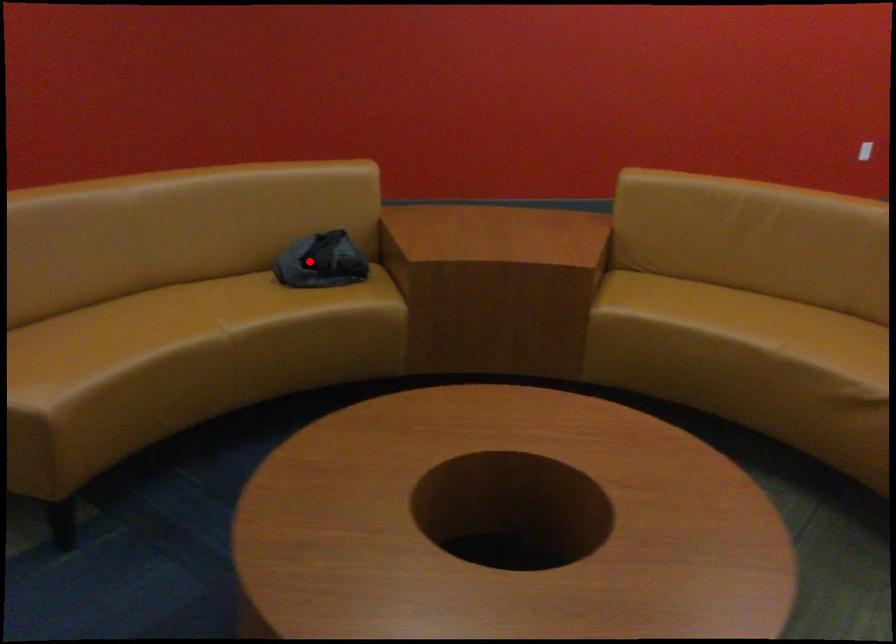
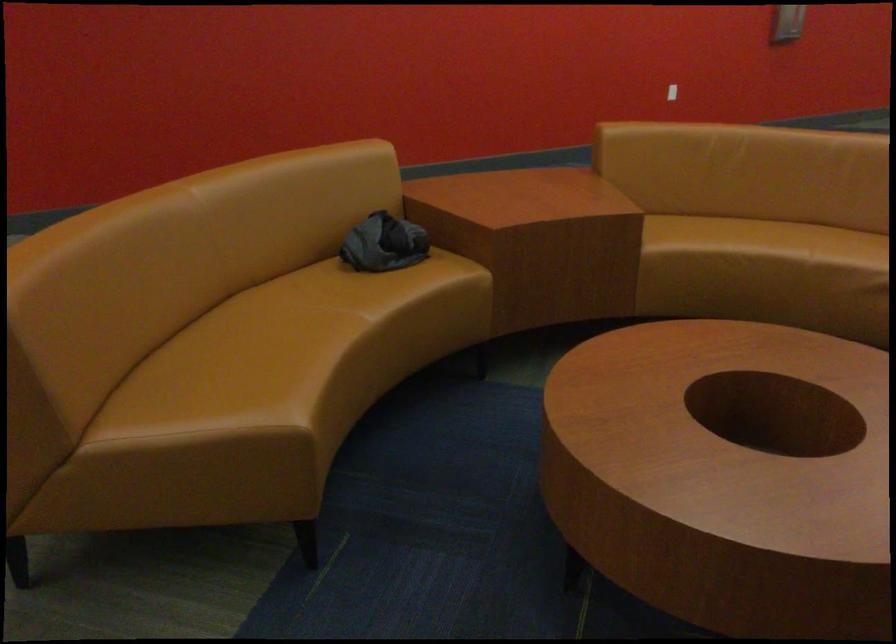
In the second image, find the point that corresponds to the highlighted location in the first image.

(383, 243)